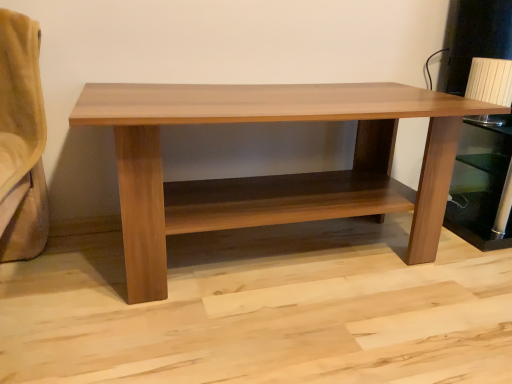
Describe the element at coordinates (270, 176) in the screenshot. I see `wooden table at center` at that location.

Locate an element on the screen. wooden table at center is located at coordinates pos(270,176).

At what (x,y) coordinates should I click in order to perform the action: click on brown wood shelf at right. Please return your answer as a coordinate pair (x, y). The width and height of the screenshot is (512, 384). Looking at the image, I should click on (480, 184).

What do you see at coordinates (480, 184) in the screenshot? The height and width of the screenshot is (384, 512). I see `brown wood shelf at right` at bounding box center [480, 184].

Locate an element on the screen. The height and width of the screenshot is (384, 512). wooden table at center is located at coordinates (270, 176).

Can you confirm if brown wood shelf at right is positioned to the right of wooden table at center?

Correct, you'll find brown wood shelf at right to the right of wooden table at center.

Considering their positions, is brown wood shelf at right located in front of or behind wooden table at center?

brown wood shelf at right is behind wooden table at center.

Does point (490, 144) appear closer or farther from the camera than point (178, 202)?

Point (490, 144) is farther from the camera than point (178, 202).

From the image's perspective, between brown wood shelf at right and wooden table at center, which one is located above?

brown wood shelf at right is shown above in the image.

From a real-world perspective, is brown wood shelf at right physically above wooden table at center?

Actually, brown wood shelf at right is physically below wooden table at center in the real world.

In the scene shown: Does brown wood shelf at right have a greater width compared to wooden table at center?

Incorrect, the width of brown wood shelf at right does not surpass that of wooden table at center.

Who is shorter, brown wood shelf at right or wooden table at center?

brown wood shelf at right is shorter.

Can you confirm if brown wood shelf at right is smaller than wooden table at center?

Yes, brown wood shelf at right is smaller than wooden table at center.

Is brown wood shelf at right inside the boundaries of wooden table at center, or outside?

brown wood shelf at right lies outside wooden table at center.

Would you consider brown wood shelf at right to be distant from wooden table at center?

Actually, brown wood shelf at right and wooden table at center are a little close together.

Could you tell me if brown wood shelf at right is turned towards wooden table at center?

No, brown wood shelf at right does not turn towards wooden table at center.

How much distance is there between brown wood shelf at right and wooden table at center?

brown wood shelf at right is 65.63 centimeters away from wooden table at center.

Identify the location of shelf behind the wooden table at center. This screenshot has height=384, width=512. (480, 184).

Between wooden table at center and brown wood shelf at right, which one appears on the left side from the viewer's perspective?

Positioned to the left is wooden table at center.

Which object is more forward, wooden table at center or brown wood shelf at right?

wooden table at center.

Which is closer to the camera, (144, 287) or (449, 204)?

Point (144, 287)

From the image's perspective, who appears lower, wooden table at center or brown wood shelf at right?

wooden table at center.

From a real-world perspective, is wooden table at center positioned above or below brown wood shelf at right?

From a real-world perspective, wooden table at center is physically above brown wood shelf at right.

Between wooden table at center and brown wood shelf at right, which one has larger width?

With larger width is wooden table at center.

Considering the relative sizes of wooden table at center and brown wood shelf at right in the image provided, is wooden table at center taller than brown wood shelf at right?

Yes.

Can you confirm if wooden table at center is smaller than brown wood shelf at right?

No, wooden table at center is not smaller than brown wood shelf at right.

Could brown wood shelf at right be considered to be inside wooden table at center?

No, brown wood shelf at right is not a part of wooden table at center.

In the scene shown: Is wooden table at center placed right next to brown wood shelf at right?

No, wooden table at center is not making contact with brown wood shelf at right.

Is wooden table at center looking in the opposite direction of brown wood shelf at right?

wooden table at center does not have its back to brown wood shelf at right.

You are a GUI agent. You are given a task and a screenshot of the screen. Output one action in this format:
    pyautogui.click(x=<x>, y=<y>)
    Task: Click on the table in front of the brown wood shelf at right
    The image size is (512, 384).
    Given the screenshot: What is the action you would take?
    pyautogui.click(x=270, y=176)

Identify the location of shelf that appears below the wooden table at center (from a real-world perspective). (480, 184).

Where is `table in front of the brown wood shelf at right`? Image resolution: width=512 pixels, height=384 pixels. table in front of the brown wood shelf at right is located at coordinates (270, 176).